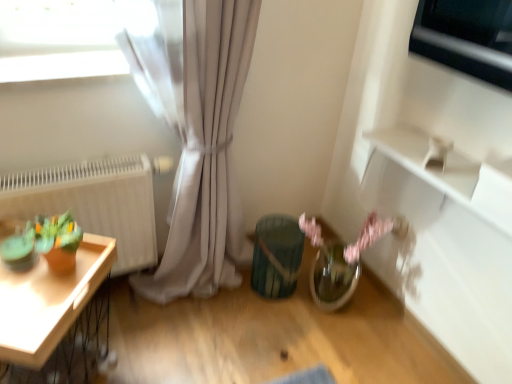
At what (x,y) coordinates should I click in order to perform the action: click on vacant region under metallic silver window at upper right (from a real-world perspective). Please return your answer as a coordinate pair (x, y). This screenshot has width=512, height=384. Looking at the image, I should click on (391, 324).